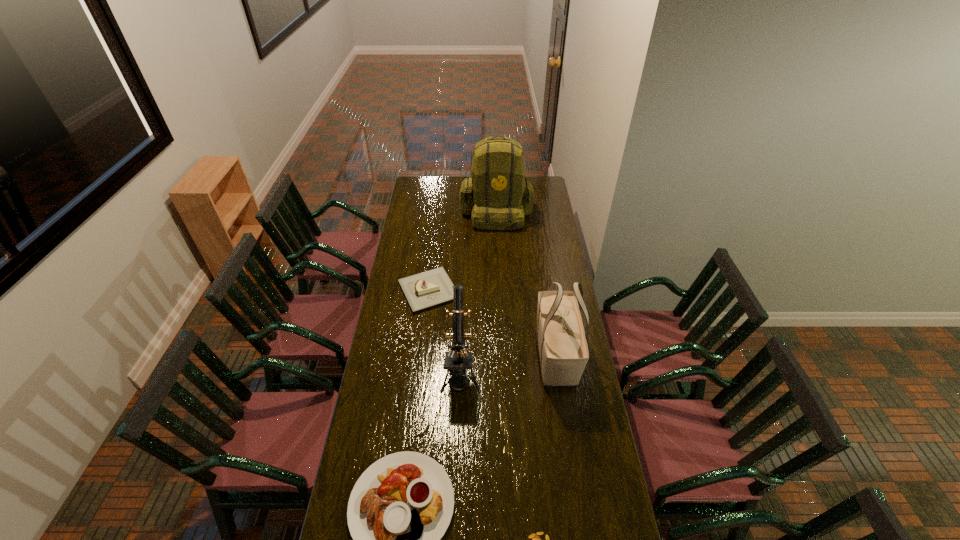
The height and width of the screenshot is (540, 960). What are the coordinates of `object at the left edge` in the screenshot? It's located at (426, 289).

The image size is (960, 540). Identify the location of backpack that is at the right edge. (501, 194).

Locate an element on the screen. shopping bag situated at the right edge is located at coordinates (563, 351).

In order to click on object located at the far right corner in this screenshot , I will do `click(501, 194)`.

At what (x,y) coordinates should I click in order to perform the action: click on vacant area at the far edge. Please return your answer as a coordinate pair (x, y). Image resolution: width=960 pixels, height=540 pixels. Looking at the image, I should click on (460, 185).

Where is `free space at the right edge`? free space at the right edge is located at coordinates (566, 272).

The image size is (960, 540). I want to click on vacant space at the far left corner of the desktop, so click(420, 190).

The height and width of the screenshot is (540, 960). In order to click on empty location between the shopping bag and the backpack in this screenshot , I will do `click(526, 284)`.

Locate an element on the screen. empty location between the backpack and the microscope is located at coordinates (478, 293).

Locate an element on the screen. vacant area that lies between the microscope and the backpack is located at coordinates (478, 293).